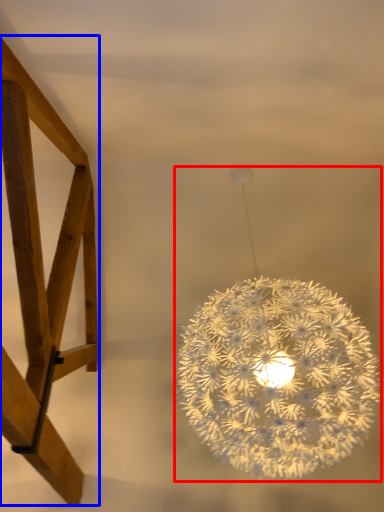
Question: Among these objects, which one is farthest to the camera, lamp (highlighted by a red box) or furniture (highlighted by a blue box)?

Choices:
 (A) lamp
 (B) furniture

Answer: (A)